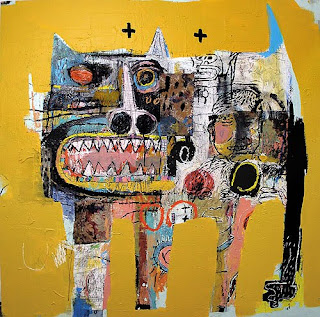
Where is `painting`? painting is located at coordinates (20, 50).